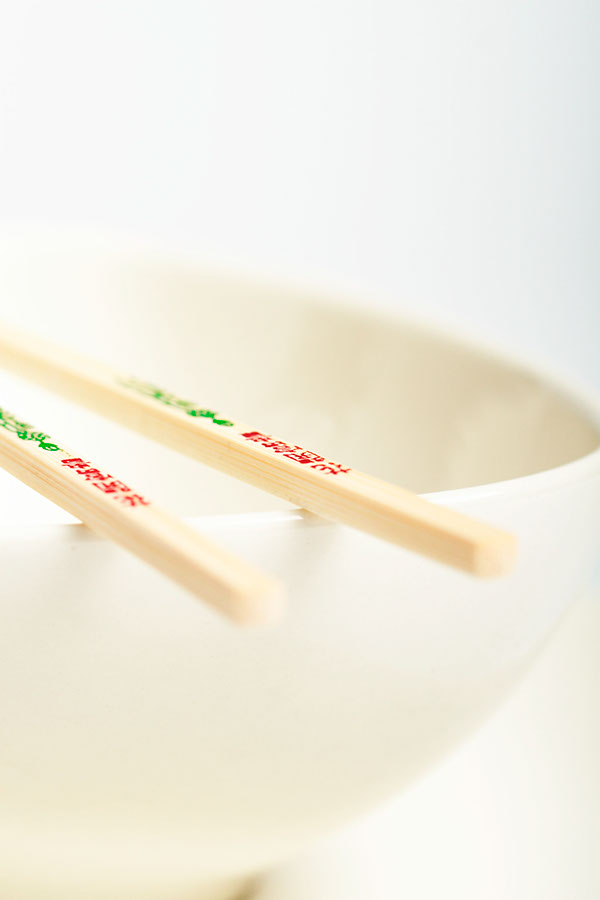
Image resolution: width=600 pixels, height=900 pixels. I want to click on chopstick, so click(42, 473), click(120, 400).